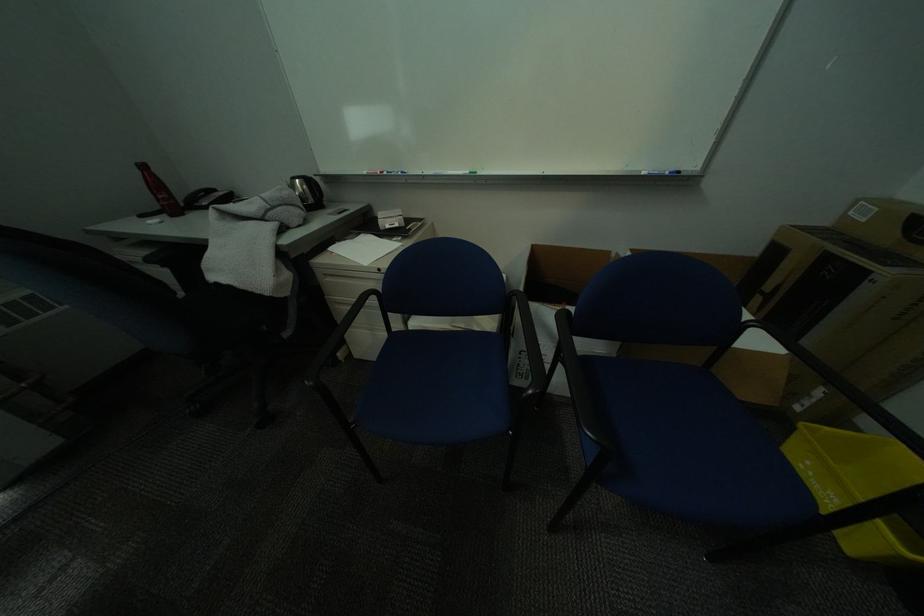
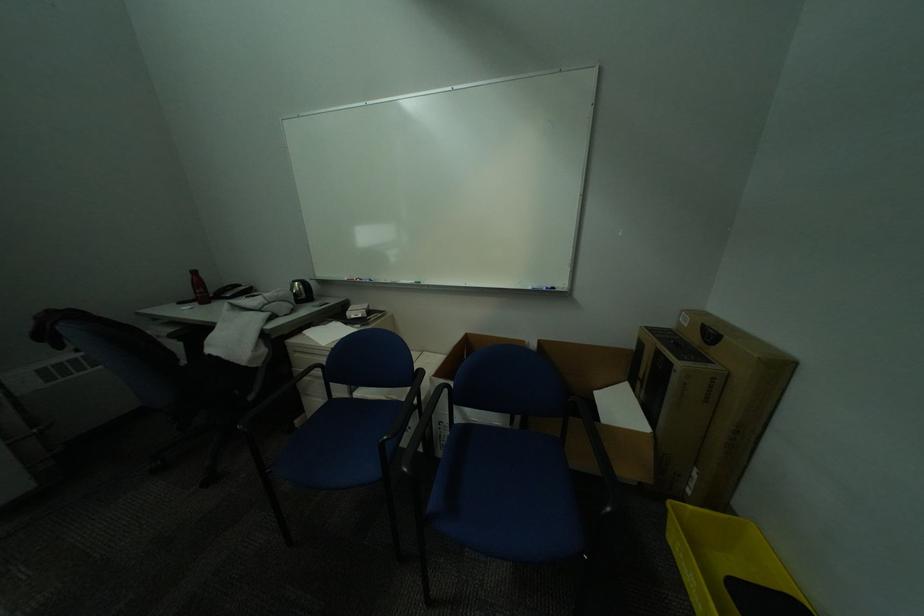
In a continuous first-person perspective shot, in which direction is the camera moving?

The cameraman moved toward right, backward.